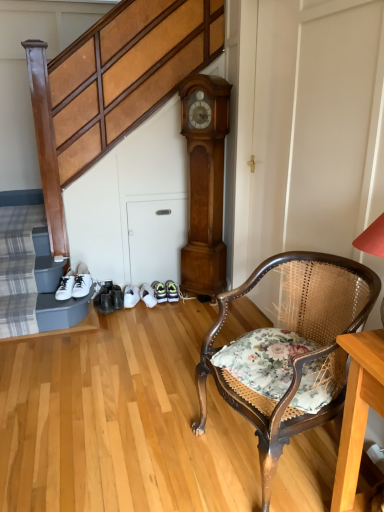
Question: Can you confirm if floral fabric cushion at lower right is thinner than floral fabric chair at lower right?

Choices:
 (A) yes
 (B) no

Answer: (A)

Question: Is floral fabric cushion at lower right taller than floral fabric chair at lower right?

Choices:
 (A) no
 (B) yes

Answer: (A)

Question: Considering the relative sizes of floral fabric cushion at lower right and floral fabric chair at lower right in the image provided, is floral fabric cushion at lower right bigger than floral fabric chair at lower right?

Choices:
 (A) no
 (B) yes

Answer: (A)

Question: Is floral fabric cushion at lower right wider than floral fabric chair at lower right?

Choices:
 (A) no
 (B) yes

Answer: (A)

Question: Is floral fabric cushion at lower right further to the viewer compared to floral fabric chair at lower right?

Choices:
 (A) yes
 (B) no

Answer: (A)

Question: Is floral fabric cushion at lower right closer to the viewer compared to floral fabric chair at lower right?

Choices:
 (A) no
 (B) yes

Answer: (A)

Question: Is light brown wood clock at center positioned behind white leather sneakers at lower left?

Choices:
 (A) yes
 (B) no

Answer: (B)

Question: Is light brown wood clock at center oriented away from white leather sneakers at lower left?

Choices:
 (A) yes
 (B) no

Answer: (B)

Question: Is light brown wood clock at center far from white leather sneakers at lower left?

Choices:
 (A) no
 (B) yes

Answer: (B)

Question: Is white leather sneakers at lower left completely or partially inside light brown wood clock at center?

Choices:
 (A) no
 (B) yes

Answer: (A)

Question: From the image's perspective, is light brown wood clock at center over white leather sneakers at lower left?

Choices:
 (A) no
 (B) yes

Answer: (B)

Question: From a real-world perspective, is light brown wood clock at center located higher than white leather sneakers at lower left?

Choices:
 (A) no
 (B) yes

Answer: (B)

Question: Considering the relative sizes of floral fabric cushion at lower right and light brown wood clock at center in the image provided, is floral fabric cushion at lower right smaller than light brown wood clock at center?

Choices:
 (A) no
 (B) yes

Answer: (B)